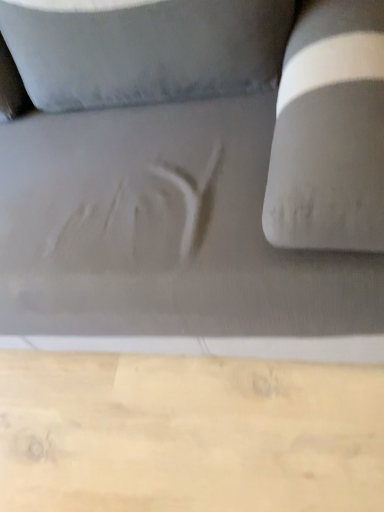
Question: Should I look upward or downward to see matte gray fabric couch at center?

Choices:
 (A) down
 (B) up

Answer: (B)

Question: Is matte gray fabric couch at center next to wooden plank at lower center and touching it?

Choices:
 (A) no
 (B) yes

Answer: (A)

Question: Can you confirm if matte gray fabric couch at center is positioned to the left of wooden plank at lower center?

Choices:
 (A) yes
 (B) no

Answer: (A)

Question: Is matte gray fabric couch at center closer to the viewer compared to wooden plank at lower center?

Choices:
 (A) no
 (B) yes

Answer: (B)

Question: Does matte gray fabric couch at center have a lesser height compared to wooden plank at lower center?

Choices:
 (A) yes
 (B) no

Answer: (B)

Question: Is matte gray fabric couch at center behind wooden plank at lower center?

Choices:
 (A) no
 (B) yes

Answer: (A)

Question: Is matte gray fabric couch at center oriented away from wooden plank at lower center?

Choices:
 (A) yes
 (B) no

Answer: (B)

Question: Is matte gray fabric couch at center located within wooden plank at lower center?

Choices:
 (A) no
 (B) yes

Answer: (A)

Question: Is wooden plank at lower center looking in the opposite direction of matte gray fabric couch at center?

Choices:
 (A) no
 (B) yes

Answer: (A)

Question: Can you confirm if wooden plank at lower center is smaller than matte gray fabric couch at center?

Choices:
 (A) yes
 (B) no

Answer: (A)

Question: Would you consider wooden plank at lower center to be distant from matte gray fabric couch at center?

Choices:
 (A) no
 (B) yes

Answer: (A)

Question: Is wooden plank at lower center thinner than matte gray fabric couch at center?

Choices:
 (A) yes
 (B) no

Answer: (B)

Question: Does wooden plank at lower center have a greater width compared to matte gray fabric couch at center?

Choices:
 (A) no
 (B) yes

Answer: (B)

Question: Is point (297, 160) closer or farther from the camera than point (331, 479)?

Choices:
 (A) closer
 (B) farther

Answer: (A)